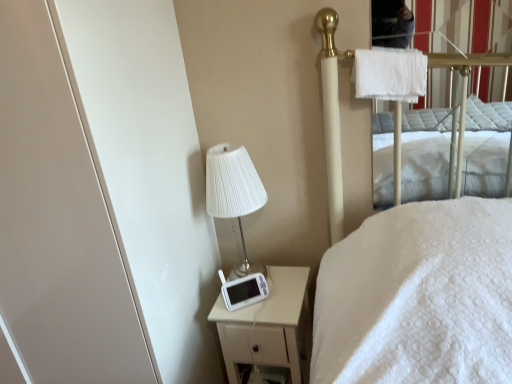
Question: Is white glossy screen door at left not within white pleated fabric lampshade at upper left?

Choices:
 (A) yes
 (B) no

Answer: (A)

Question: Can you confirm if white glossy screen door at left is wider than white pleated fabric lampshade at upper left?

Choices:
 (A) no
 (B) yes

Answer: (B)

Question: Does white glossy screen door at left have a greater height compared to white pleated fabric lampshade at upper left?

Choices:
 (A) yes
 (B) no

Answer: (A)

Question: From a real-world perspective, is white glossy screen door at left on white pleated fabric lampshade at upper left?

Choices:
 (A) no
 (B) yes

Answer: (A)

Question: Is white pleated fabric lampshade at upper left a part of white glossy screen door at left?

Choices:
 (A) no
 (B) yes

Answer: (A)

Question: Is there a large distance between white glossy screen door at left and white pleated fabric lampshade at upper left?

Choices:
 (A) yes
 (B) no

Answer: (B)

Question: Considering the relative positions of white fluffy towel at upper right and white pleated fabric lampshade at upper left in the image provided, is white fluffy towel at upper right in front of white pleated fabric lampshade at upper left?

Choices:
 (A) no
 (B) yes

Answer: (B)

Question: From a real-world perspective, does white fluffy towel at upper right stand above white pleated fabric lampshade at upper left?

Choices:
 (A) no
 (B) yes

Answer: (B)

Question: Can you confirm if white fluffy towel at upper right is positioned to the left of white pleated fabric lampshade at upper left?

Choices:
 (A) yes
 (B) no

Answer: (B)

Question: Is white fluffy towel at upper right shorter than white pleated fabric lampshade at upper left?

Choices:
 (A) yes
 (B) no

Answer: (A)

Question: Could white pleated fabric lampshade at upper left be considered to be inside white fluffy towel at upper right?

Choices:
 (A) no
 (B) yes

Answer: (A)

Question: Is white fluffy towel at upper right wider than white pleated fabric lampshade at upper left?

Choices:
 (A) no
 (B) yes

Answer: (A)

Question: Considering the relative sizes of white glossy screen door at left and white fluffy towel at upper right in the image provided, is white glossy screen door at left smaller than white fluffy towel at upper right?

Choices:
 (A) no
 (B) yes

Answer: (A)